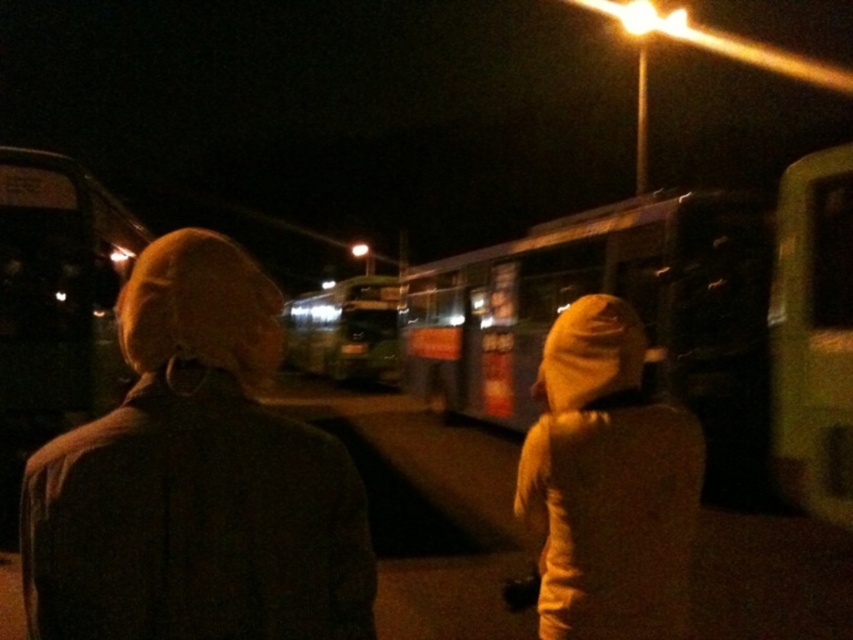
What do you see at coordinates (622, 298) in the screenshot? I see `metallic silver bus at center` at bounding box center [622, 298].

You are a GUI agent. You are given a task and a screenshot of the screen. Output one action in this format:
    pyautogui.click(x=<x>, y=<y>)
    Task: Click on the metallic silver bus at center
    This screenshot has width=853, height=640.
    Given the screenshot: What is the action you would take?
    pyautogui.click(x=622, y=298)

Image resolution: width=853 pixels, height=640 pixels. In order to click on metallic silver bus at center in this screenshot , I will do `click(622, 298)`.

This screenshot has height=640, width=853. What do you see at coordinates (195, 480) in the screenshot?
I see `brown woolen hat at upper left` at bounding box center [195, 480].

Who is positioned more to the right, brown woolen hat at upper left or metallic bus at left?

brown woolen hat at upper left

Is point (154, 380) farther from camera compared to point (7, 317)?

No, it is not.

Identify the location of brown woolen hat at upper left. (195, 480).

Is metallic silver bus at center closer to the viewer compared to yellow-green plastic bus at right?

No, it is not.

Is metallic silver bus at center smaller than yellow-green plastic bus at right?

No, metallic silver bus at center is not smaller than yellow-green plastic bus at right.

Between point (657, 200) and point (822, 413), which one is positioned in front?

Point (822, 413)

Where is `metallic silver bus at center`? metallic silver bus at center is located at coordinates (622, 298).